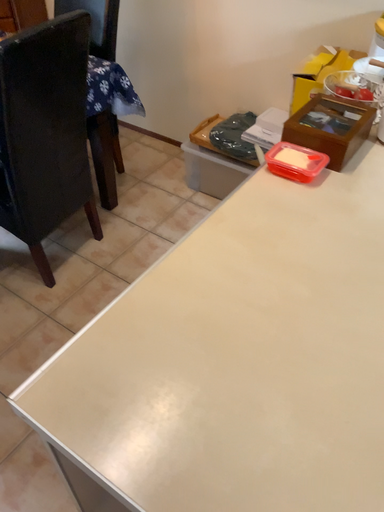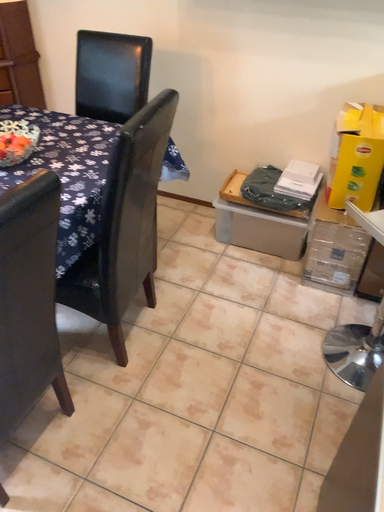
Question: How did the camera likely rotate when shooting the video?

Choices:
 (A) rotated left
 (B) rotated right

Answer: (B)